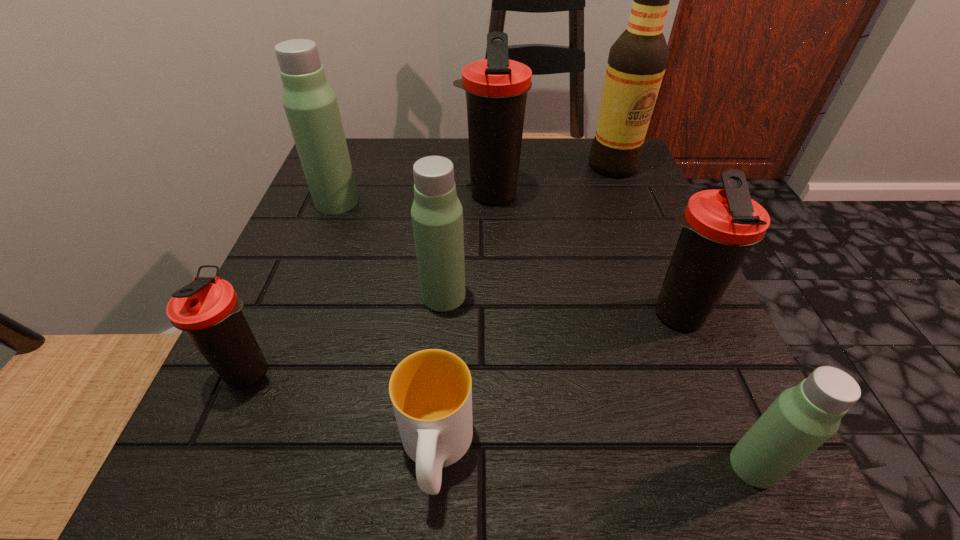
Image resolution: width=960 pixels, height=540 pixels. In order to click on vacant space located 0.110m on the back of the second biggest light thermos bottle in this screenshot , I will do coord(448,238).

Identify the location of vacant space positioned on the right of the sixth farthest object. (566, 371).

You are a GUI agent. You are given a task and a screenshot of the screen. Output one action in this format:
    pyautogui.click(x=<x>, y=<y>)
    Task: Click on the free space located 0.130m on the back of the nearest light thermos bottle
    Image resolution: width=960 pixels, height=540 pixels.
    Given the screenshot: What is the action you would take?
    pyautogui.click(x=706, y=356)

You are a GUI agent. You are given a task and a screenshot of the screen. Output one action in this format:
    pyautogui.click(x=<x>, y=<y>)
    Task: Click on the alcohol that is at the far edge
    
    Given the screenshot: What is the action you would take?
    pyautogui.click(x=637, y=61)

What are the coordinates of `thermos bottle that is at the near edge` in the screenshot? It's located at (802, 418).

Locate an element on the screen. cup positioned at the near edge is located at coordinates (431, 390).

At what (x,y) coordinates should I click in order to perform the action: click on alcohol that is at the right edge. Please return your answer as a coordinate pair (x, y). Looking at the image, I should click on (637, 61).

What are the coordinates of `object that is at the far left corner` in the screenshot? It's located at (310, 104).

Where is `object at the far right corner`? The image size is (960, 540). object at the far right corner is located at coordinates (637, 61).

At what (x,y) coordinates should I click in order to perform the action: click on object that is at the near right corner. Please return your answer as a coordinate pair (x, y). The image size is (960, 540). Looking at the image, I should click on (802, 418).